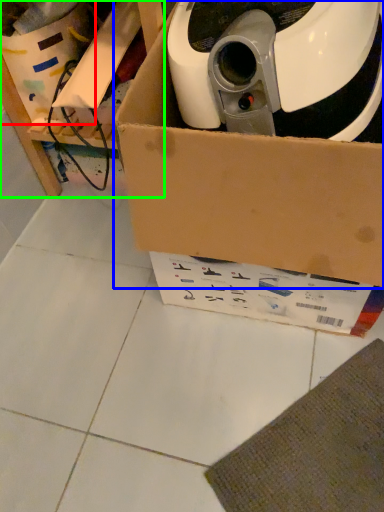
Question: Which object is the closest to the storage box (highlighted by a red box)? Choose among these: box (highlighted by a blue box) or furniture (highlighted by a green box).

Choices:
 (A) box
 (B) furniture

Answer: (B)